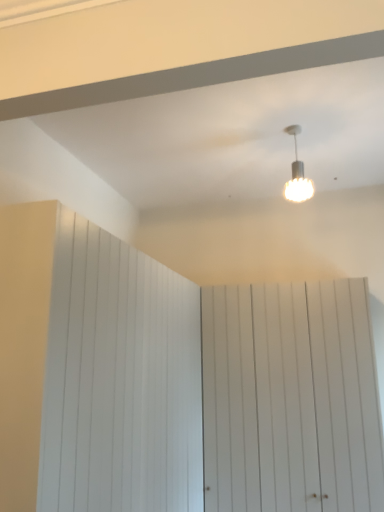
Question: In which direction should I rotate to look at white wood barn door at center, the first barn door in the right-to-left sequence?

Choices:
 (A) left
 (B) right

Answer: (B)

Question: Considering the relative positions of white wood barn door at left, which appears as the second barn door when viewed from the right, and white wood barn door at center, acting as the 2th barn door starting from the left, in the image provided, is white wood barn door at left, which appears as the second barn door when viewed from the right, to the left of white wood barn door at center, acting as the 2th barn door starting from the left, from the viewer's perspective?

Choices:
 (A) no
 (B) yes

Answer: (B)

Question: Can you confirm if white wood barn door at left, which appears as the second barn door when viewed from the right, is bigger than white wood barn door at center, acting as the 2th barn door starting from the left?

Choices:
 (A) no
 (B) yes

Answer: (B)

Question: Is white wood barn door at left, which appears as the second barn door when viewed from the right, taller than white wood barn door at center, the first barn door in the right-to-left sequence?

Choices:
 (A) no
 (B) yes

Answer: (B)

Question: From the image's perspective, is white wood barn door at left, which appears as the second barn door when viewed from the right, above white wood barn door at center, the first barn door in the right-to-left sequence?

Choices:
 (A) no
 (B) yes

Answer: (B)

Question: Is white wood barn door at left, which appears as the second barn door when viewed from the right, not near white wood barn door at center, the first barn door in the right-to-left sequence?

Choices:
 (A) yes
 (B) no

Answer: (B)

Question: Is white wood barn door at left, which appears as the 1th barn door when viewed from the left, positioned with its back to white wood barn door at center, acting as the 2th barn door starting from the left?

Choices:
 (A) no
 (B) yes

Answer: (A)

Question: Is white wood barn door at left, which appears as the 1th barn door when viewed from the left, placed right next to white textured lamp at upper center?

Choices:
 (A) no
 (B) yes

Answer: (A)

Question: Could you tell me if white wood barn door at left, which appears as the second barn door when viewed from the right, is turned towards white textured lamp at upper center?

Choices:
 (A) no
 (B) yes

Answer: (A)

Question: Is white wood barn door at left, which appears as the 1th barn door when viewed from the left, thinner than white textured lamp at upper center?

Choices:
 (A) no
 (B) yes

Answer: (A)

Question: From the image's perspective, would you say white wood barn door at left, which appears as the 1th barn door when viewed from the left, is positioned over white textured lamp at upper center?

Choices:
 (A) yes
 (B) no

Answer: (B)

Question: Is white wood barn door at left, which appears as the 1th barn door when viewed from the left, turned away from white textured lamp at upper center?

Choices:
 (A) yes
 (B) no

Answer: (B)

Question: Is white wood barn door at left, which appears as the 1th barn door when viewed from the left, shorter than white textured lamp at upper center?

Choices:
 (A) yes
 (B) no

Answer: (B)

Question: Is white wood barn door at center, the first barn door in the right-to-left sequence, far away from white textured lamp at upper center?

Choices:
 (A) no
 (B) yes

Answer: (B)